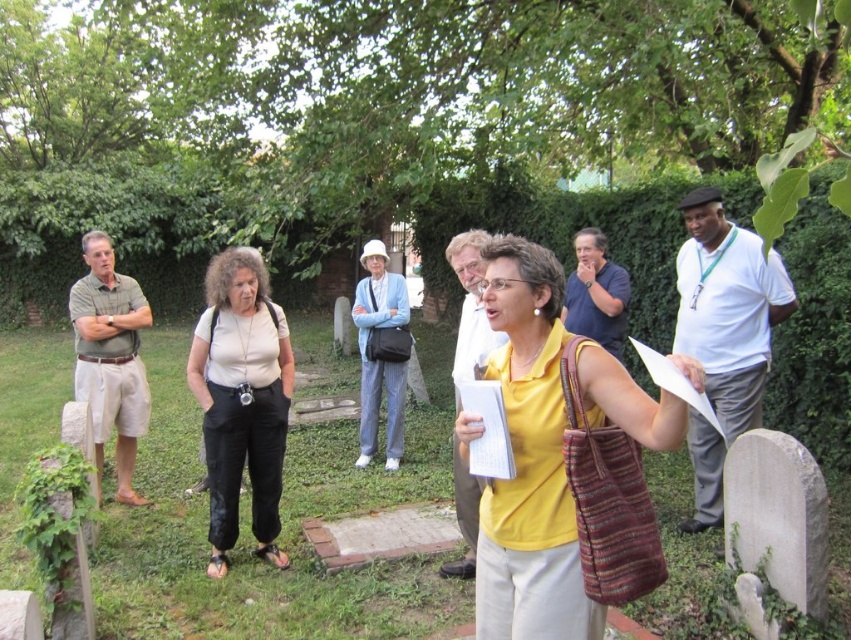
You are part of a tour group in the cemetery and need to identify the guide. The guide is wearing a white cotton shirt at center. However, there is also a matte white shirt at center. Which shirt is larger and thus more likely to belong to the guide?

The white cotton shirt at center is bigger than the matte white shirt at center, so the guide is likely wearing the white cotton shirt at center.

You are standing at point (x=480, y=243) and want to walk to point (x=377, y=273). Is the destination point in front of or behind you?

The destination point (x=377, y=273) is behind you since it is stated to be behind point (x=480, y=243).

You are a photographer trying to capture a photo of the light blue striped pants at center and the matte white shirt at center. Based on their sizes, which one should you focus on first if you want to ensure both are in frame without moving the camera?

The light blue striped pants at center is much taller than the matte white shirt at center, so you should focus on the light blue striped pants at center first to ensure it fits within the frame.